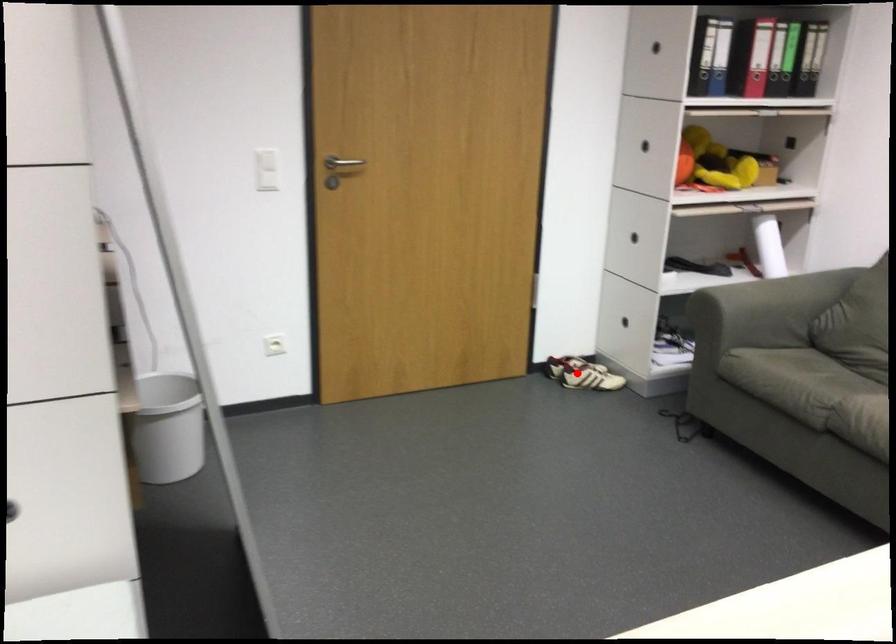
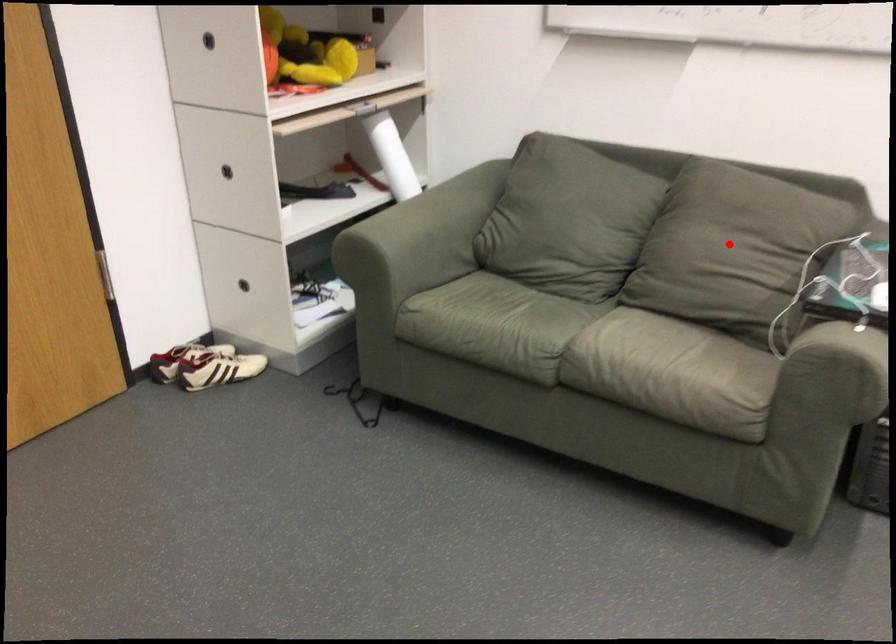
I am providing you with two images of the same scene from different viewpoints. A red point is marked on the first image and another point is marked on the second image. Is the marked point in image1 the same physical position as the marked point in image2?

No